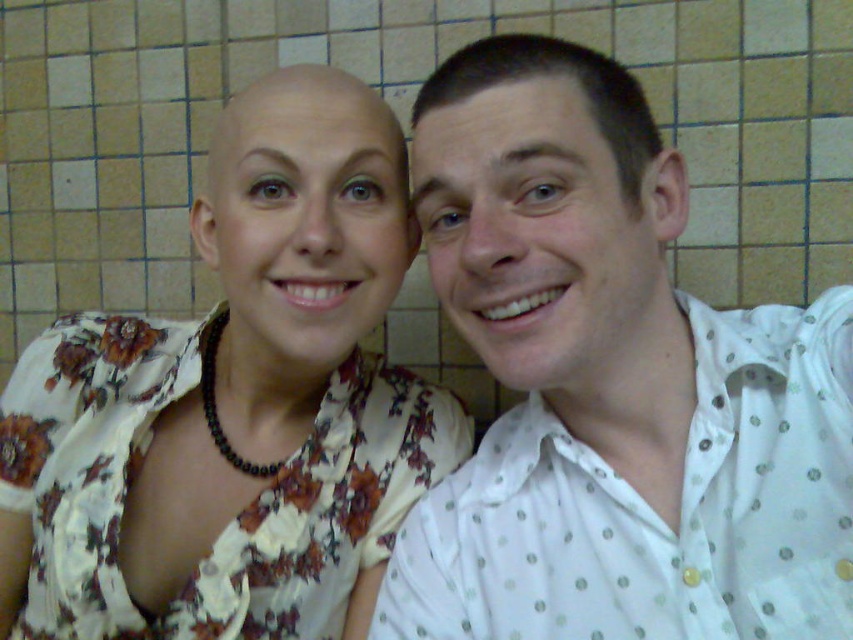
Which is more to the right, floral fabric dress at center or beige tile at center?

beige tile at center is more to the right.

Is point (248, 337) closer to camera compared to point (440, 320)?

Yes, it is in front of point (440, 320).

Does point (234, 445) come in front of point (751, 161)?

Yes, it is in front of point (751, 161).

Identify the location of floral fabric dress at center. (234, 404).

The image size is (853, 640). What do you see at coordinates (611, 387) in the screenshot?
I see `white dotted shirt at upper right` at bounding box center [611, 387].

Is white dotted shirt at upper right positioned before floral fabric dress at center?

Yes, white dotted shirt at upper right is in front of floral fabric dress at center.

Does point (570, 173) come farther from viewer compared to point (228, 442)?

No, (570, 173) is closer to viewer.

I want to click on white dotted shirt at upper right, so click(x=611, y=387).

Is white dotted shirt at upper right in front of beige tile at center?

Yes, it is in front of beige tile at center.

Does point (550, 627) lie behind point (102, 83)?

No.

Find the location of a particular element. The width and height of the screenshot is (853, 640). white dotted shirt at upper right is located at coordinates (611, 387).